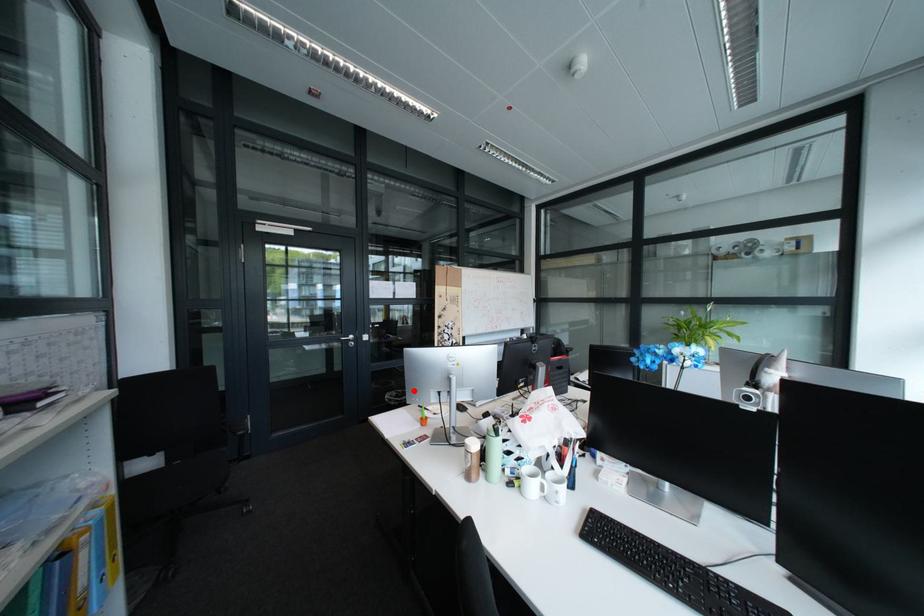
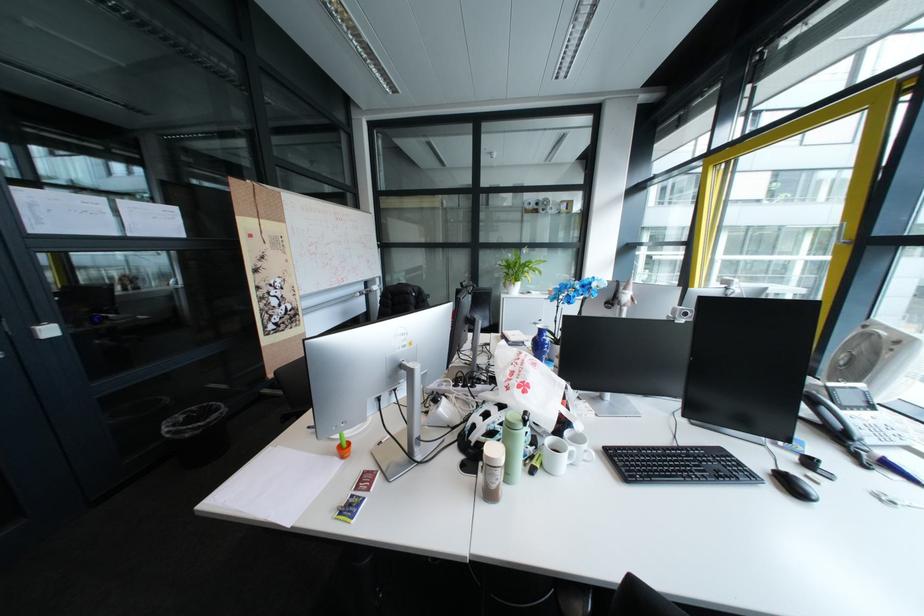
In the second image, find the point that corresponds to the highlighted location in the first image.

(208, 408)